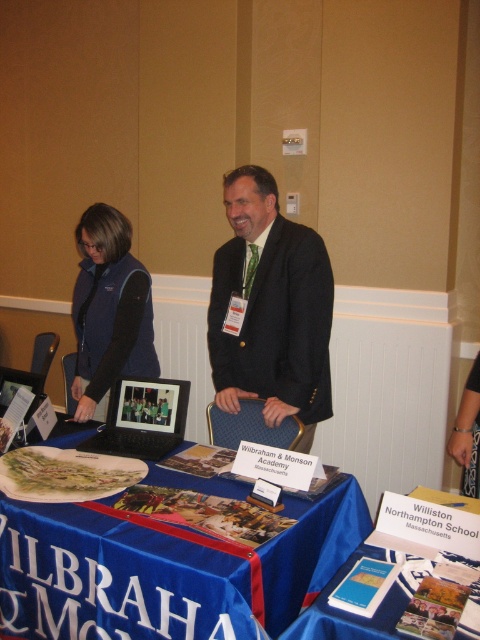
Question: Which object is positioned closest to the blue fabric table at center?

Choices:
 (A) black matte laptop at center
 (B) blue fabric tablecloth at center

Answer: (B)

Question: Does blue fabric tablecloth at center appear over blue fabric table at center?

Choices:
 (A) no
 (B) yes

Answer: (A)

Question: Which point is farther from the camera taking this photo?

Choices:
 (A) (121, 365)
 (B) (418, 520)
 (C) (186, 637)

Answer: (A)

Question: Which is nearer to the blue fabric tablecloth at center?

Choices:
 (A) dark suit at center
 (B) blue fabric table at center

Answer: (B)

Question: Considering the relative positions of blue fabric tablecloth at center and matte blue vest at center in the image provided, where is blue fabric tablecloth at center located with respect to matte blue vest at center?

Choices:
 (A) left
 (B) right

Answer: (B)

Question: Is blue fabric tablecloth at center above black matte laptop at center?

Choices:
 (A) no
 (B) yes

Answer: (A)